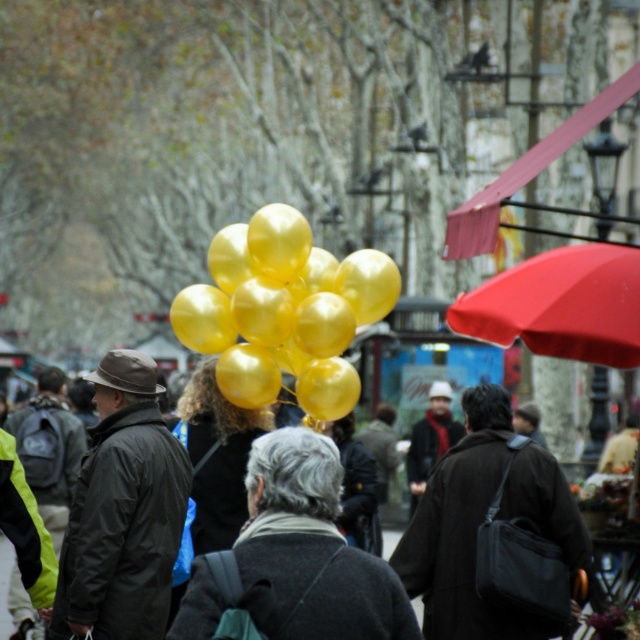
Question: Does metallic gold balloons at center appear on the left side of red matte umbrella at upper right?

Choices:
 (A) yes
 (B) no

Answer: (A)

Question: Which of the following is the closest to the observer?

Choices:
 (A) red matte umbrella at upper right
 (B) metallic gold balloons at center

Answer: (A)

Question: Which object appears farthest from the camera in this image?

Choices:
 (A) red matte umbrella at upper right
 (B) metallic gold balloons at center

Answer: (B)

Question: Observing the image, what is the correct spatial positioning of metallic gold balloons at center in reference to red matte umbrella at upper right?

Choices:
 (A) left
 (B) right

Answer: (A)

Question: In this image, where is metallic gold balloons at center located relative to red matte umbrella at upper right?

Choices:
 (A) right
 (B) left

Answer: (B)

Question: Among these objects, which one is nearest to the camera?

Choices:
 (A) metallic gold balloons at center
 (B) red matte umbrella at upper right

Answer: (B)